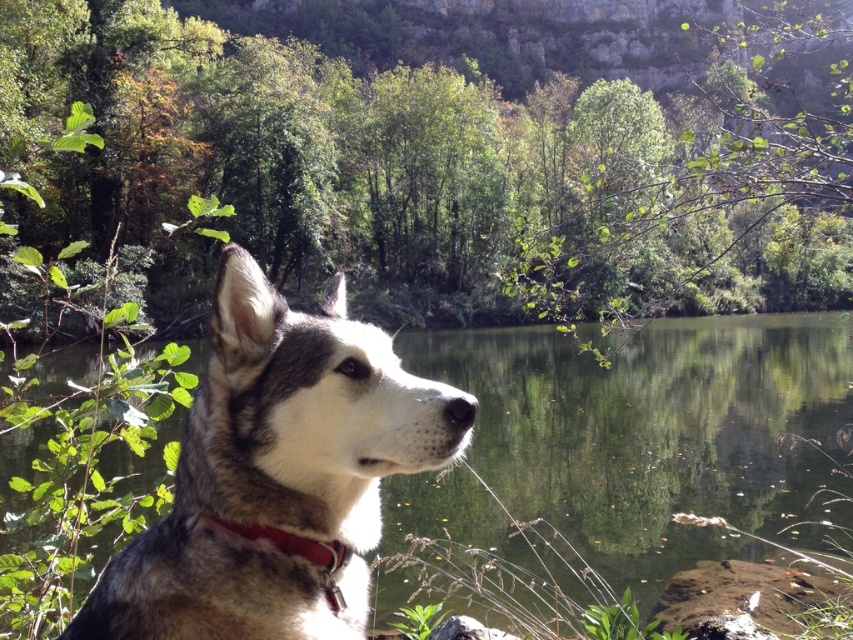
Question: From the image, what is the correct spatial relationship of green reflective water at center in relation to gray fur dog at left?

Choices:
 (A) below
 (B) above

Answer: (B)

Question: Which point is farther to the camera?

Choices:
 (A) (293, 513)
 (B) (433, 497)

Answer: (B)

Question: Among these objects, which one is nearest to the camera?

Choices:
 (A) gray fur dog at left
 (B) red leather collar at center
 (C) green reflective water at center
 (D) green leafy tree at upper center

Answer: (A)

Question: Which point is farther from the camera taking this photo?

Choices:
 (A) (241, 531)
 (B) (368, 516)
 (C) (647, 500)
 (D) (415, 260)

Answer: (D)

Question: Is green leafy tree at upper center below green reflective water at center?

Choices:
 (A) no
 (B) yes

Answer: (A)

Question: Can you confirm if green reflective water at center is positioned above gray fur dog at left?

Choices:
 (A) no
 (B) yes

Answer: (B)